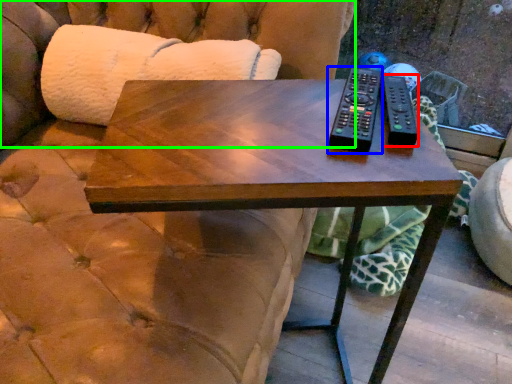
Question: Considering the real-world distances, which object is closest to remote (highlighted by a red box)? remote (highlighted by a blue box) or couch (highlighted by a green box).

Choices:
 (A) remote
 (B) couch

Answer: (A)